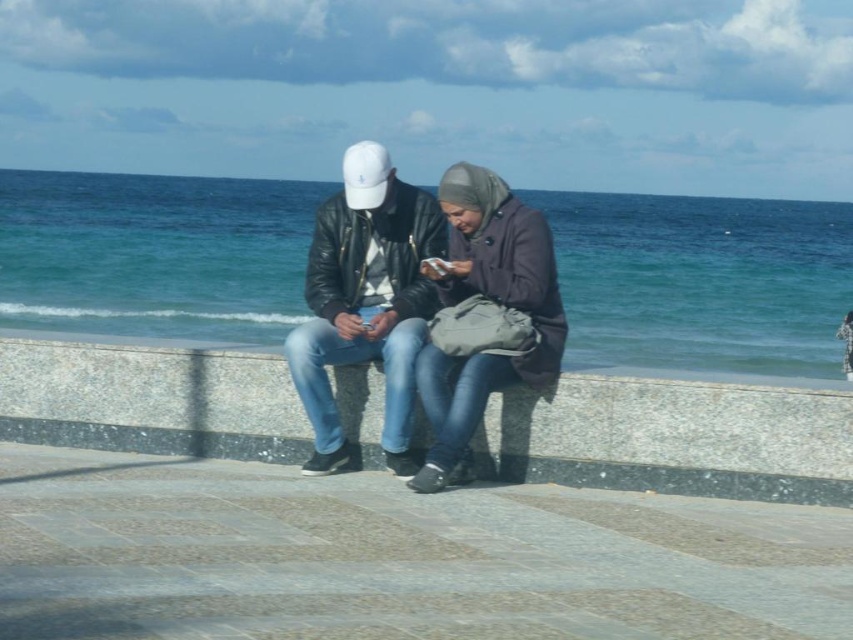
Question: Observing the image, what is the correct spatial positioning of gray concrete ledge at center in reference to matte purple coat at center?

Choices:
 (A) right
 (B) left

Answer: (B)

Question: Among these points, which one is nearest to the camera?

Choices:
 (A) (224, 442)
 (B) (556, 362)
 (C) (308, 262)

Answer: (B)

Question: Which object is farther from the camera taking this photo?

Choices:
 (A) gray concrete ledge at center
 (B) matte purple coat at center

Answer: (A)

Question: Which of the following is the farthest from the observer?

Choices:
 (A) [x=554, y=285]
 (B) [x=173, y=400]

Answer: (B)

Question: Is leather jacket at center thinner than matte purple coat at center?

Choices:
 (A) no
 (B) yes

Answer: (A)

Question: From the image, what is the correct spatial relationship of gray concrete ledge at center in relation to matte purple coat at center?

Choices:
 (A) right
 (B) left

Answer: (B)